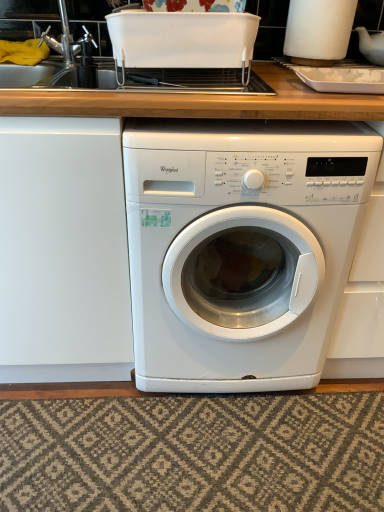
The height and width of the screenshot is (512, 384). Find the location of `vacant space to the left of white glossy container at upper right, which is the second appliance in left-to-right order`. vacant space to the left of white glossy container at upper right, which is the second appliance in left-to-right order is located at coordinates (264, 62).